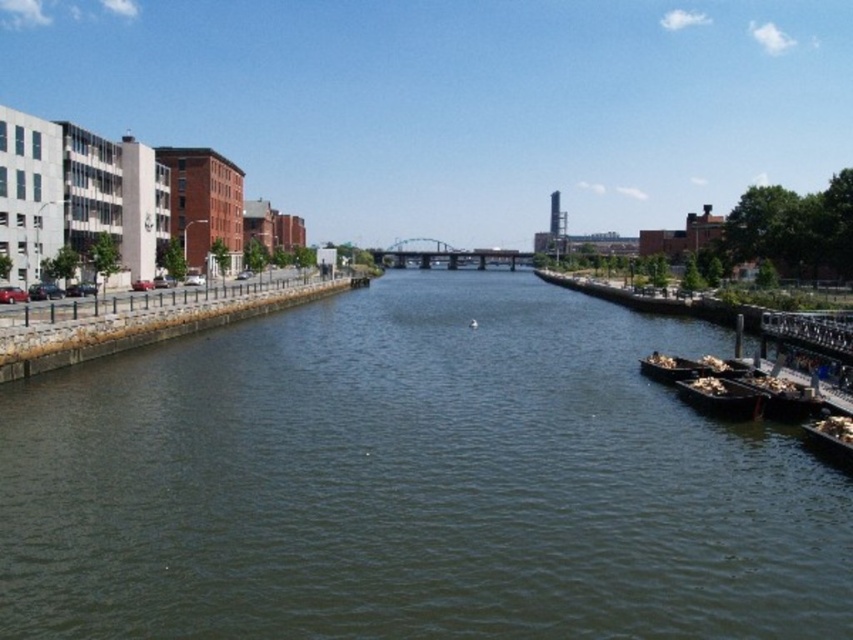
Can you confirm if dark brown wooden boat at lower right is thinner than wooden boat at right?

Yes, dark brown wooden boat at lower right is thinner than wooden boat at right.

In the scene shown: Is dark brown wooden boat at lower right wider than wooden boat at right?

In fact, dark brown wooden boat at lower right might be narrower than wooden boat at right.

Is point (706, 381) more distant than point (680, 371)?

No, (706, 381) is in front of (680, 371).

Locate an element on the screen. The image size is (853, 640). dark brown wooden boat at lower right is located at coordinates (720, 397).

Can you confirm if dark green water at center is positioned to the left of wooden boat at right?

Correct, you'll find dark green water at center to the left of wooden boat at right.

Find the location of `dark green water at center`. dark green water at center is located at coordinates (410, 483).

Is dark brown wooden boat at lower right further to the viewer compared to wooden boat at lower right?

Yes, dark brown wooden boat at lower right is behind wooden boat at lower right.

You are a GUI agent. You are given a task and a screenshot of the screen. Output one action in this format:
    pyautogui.click(x=<x>, y=<y>)
    Task: Click on the dark brown wooden boat at lower right
    The width and height of the screenshot is (853, 640).
    Given the screenshot: What is the action you would take?
    pyautogui.click(x=720, y=397)